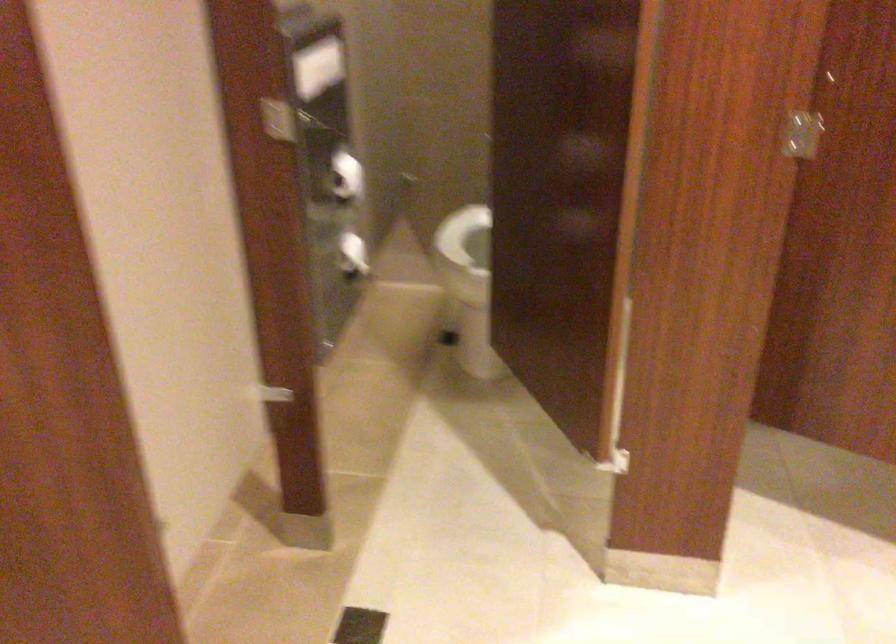
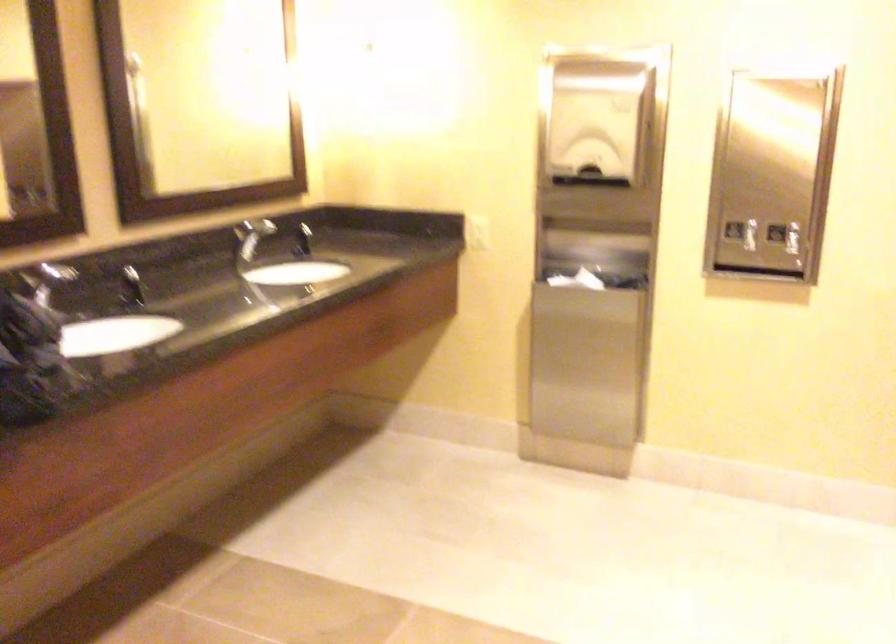
The images are taken continuously from a first-person perspective. In which direction is your viewpoint rotating?

The rotation direction of the camera is left-down.